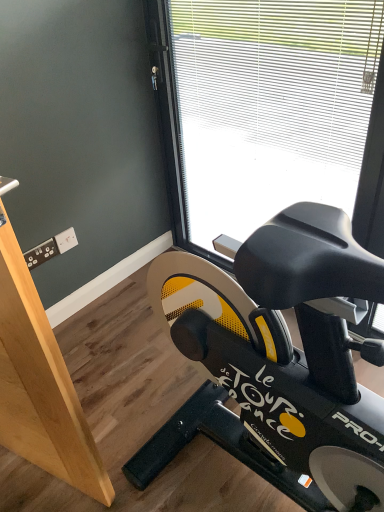
I want to click on transparent glass window at center, so click(x=277, y=108).

What is the approximate height of light brown wood at left?

It is 1.17 meters.

I want to click on light brown wood at left, so click(x=40, y=384).

The image size is (384, 512). What are the coordinates of `black matte stationary bicycle at lower right` in the screenshot? It's located at (288, 345).

Identify the location of transparent glass window at center. (277, 108).

Is transparent glass window at center directly adjacent to black matte stationary bicycle at lower right?

transparent glass window at center and black matte stationary bicycle at lower right are clearly separated.

Considering the relative sizes of transparent glass window at center and black matte stationary bicycle at lower right in the image provided, is transparent glass window at center wider than black matte stationary bicycle at lower right?

No.

Is black matte stationary bicycle at lower right located within transparent glass window at center?

Actually, black matte stationary bicycle at lower right is outside transparent glass window at center.

Does transparent glass window at center appear on the right side of black matte stationary bicycle at lower right?

Yes.

At what (x,y) coordinates should I click in order to perform the action: click on plywood above the black matte stationary bicycle at lower right (from a real-world perspective). Please return your answer as a coordinate pair (x, y). The image size is (384, 512). Looking at the image, I should click on (40, 384).

How distant is light brown wood at left from black matte stationary bicycle at lower right?

light brown wood at left and black matte stationary bicycle at lower right are 18.08 inches apart from each other.

Can black matte stationary bicycle at lower right be found inside light brown wood at left?

No, black matte stationary bicycle at lower right is not inside light brown wood at left.

Based on the photo, from the image's perspective, is light brown wood at left below black matte stationary bicycle at lower right?

No, from the image's perspective, light brown wood at left is not below black matte stationary bicycle at lower right.

From a real-world perspective, who is located higher, black matte stationary bicycle at lower right or transparent glass window at center?

transparent glass window at center.

From their relative heights in the image, would you say black matte stationary bicycle at lower right is taller or shorter than transparent glass window at center?

black matte stationary bicycle at lower right is shorter than transparent glass window at center.

Considering the sizes of objects black matte stationary bicycle at lower right and transparent glass window at center in the image provided, who is thinner, black matte stationary bicycle at lower right or transparent glass window at center?

Thinner between the two is transparent glass window at center.

Does black matte stationary bicycle at lower right have a larger size compared to transparent glass window at center?

No, black matte stationary bicycle at lower right is not bigger than transparent glass window at center.

Identify the location of plywood that is in front of the black matte stationary bicycle at lower right. (40, 384).

Is black matte stationary bicycle at lower right completely or partially outside of light brown wood at left?

black matte stationary bicycle at lower right lies outside light brown wood at left's area.

Is black matte stationary bicycle at lower right not close to light brown wood at left?

Actually, black matte stationary bicycle at lower right and light brown wood at left are a little close together.

Measure the distance from transparent glass window at center to light brown wood at left.

A distance of 1.13 meters exists between transparent glass window at center and light brown wood at left.

From a real-world perspective, which object stands above the other?

In real-world perspective, light brown wood at left is above.

Is there a large distance between transparent glass window at center and light brown wood at left?

Absolutely, transparent glass window at center is distant from light brown wood at left.

From the image's perspective, is transparent glass window at center located above or below light brown wood at left?

Based on their image positions, transparent glass window at center is located above light brown wood at left.

From a real-world perspective, who is located higher, light brown wood at left or transparent glass window at center?

light brown wood at left is physically above.

Is light brown wood at left to the left of transparent glass window at center from the viewer's perspective?

Yes, light brown wood at left is to the left of transparent glass window at center.

Considering the relative sizes of light brown wood at left and transparent glass window at center in the image provided, is light brown wood at left shorter than transparent glass window at center?

Indeed, light brown wood at left has a lesser height compared to transparent glass window at center.

Which object is further away from the camera, light brown wood at left or transparent glass window at center?

transparent glass window at center is more distant.

This screenshot has width=384, height=512. I want to click on window above the black matte stationary bicycle at lower right (from a real-world perspective), so click(277, 108).

I want to click on plywood that is above the black matte stationary bicycle at lower right (from the image's perspective), so click(x=40, y=384).

Considering their positions, is transparent glass window at center positioned further to light brown wood at left than black matte stationary bicycle at lower right?

Among the two, transparent glass window at center is located further to light brown wood at left.

Which object lies nearer to the anchor point transparent glass window at center, black matte stationary bicycle at lower right or light brown wood at left?

black matte stationary bicycle at lower right.

From the image, which object appears to be farther from black matte stationary bicycle at lower right, light brown wood at left or transparent glass window at center?

The object further to black matte stationary bicycle at lower right is transparent glass window at center.

In the scene shown: When comparing their distances from black matte stationary bicycle at lower right, does transparent glass window at center or light brown wood at left seem closer?

Based on the image, light brown wood at left appears to be nearer to black matte stationary bicycle at lower right.

When comparing their distances from transparent glass window at center, does light brown wood at left or black matte stationary bicycle at lower right seem further?

Among the two, light brown wood at left is located further to transparent glass window at center.

Looking at this image, based on their spatial positions, is black matte stationary bicycle at lower right or transparent glass window at center closer to light brown wood at left?

black matte stationary bicycle at lower right is positioned closer to the anchor light brown wood at left.

Where is `plywood between transparent glass window at center and black matte stationary bicycle at lower right in the vertical direction`? Image resolution: width=384 pixels, height=512 pixels. plywood between transparent glass window at center and black matte stationary bicycle at lower right in the vertical direction is located at coordinates pos(40,384).